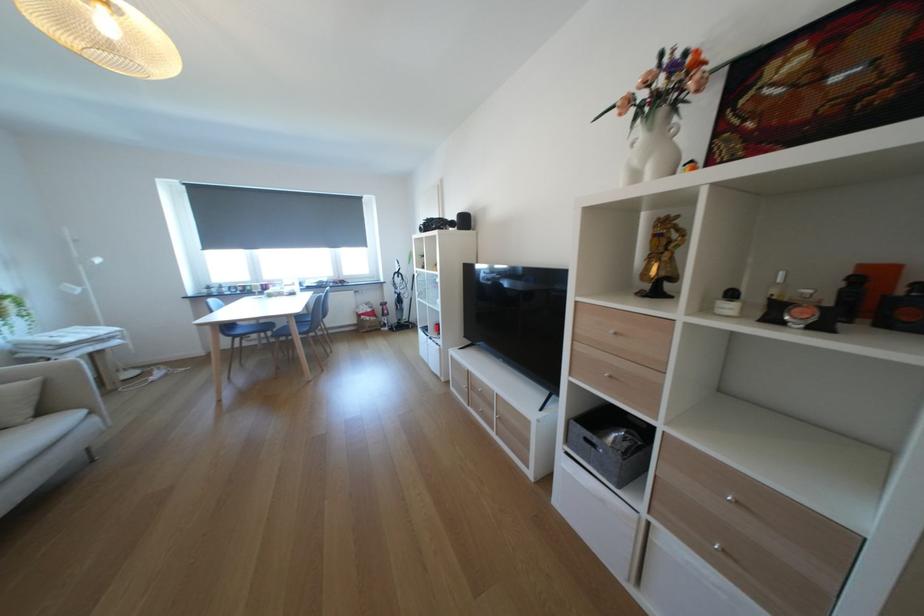
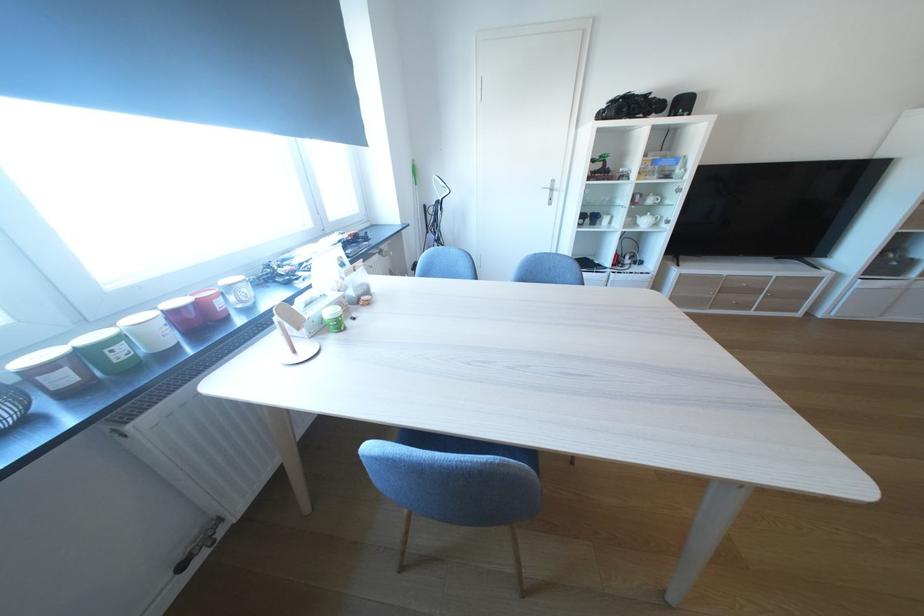
Find the pixel in the second image that matches point 260,290 in the first image.

(129, 354)